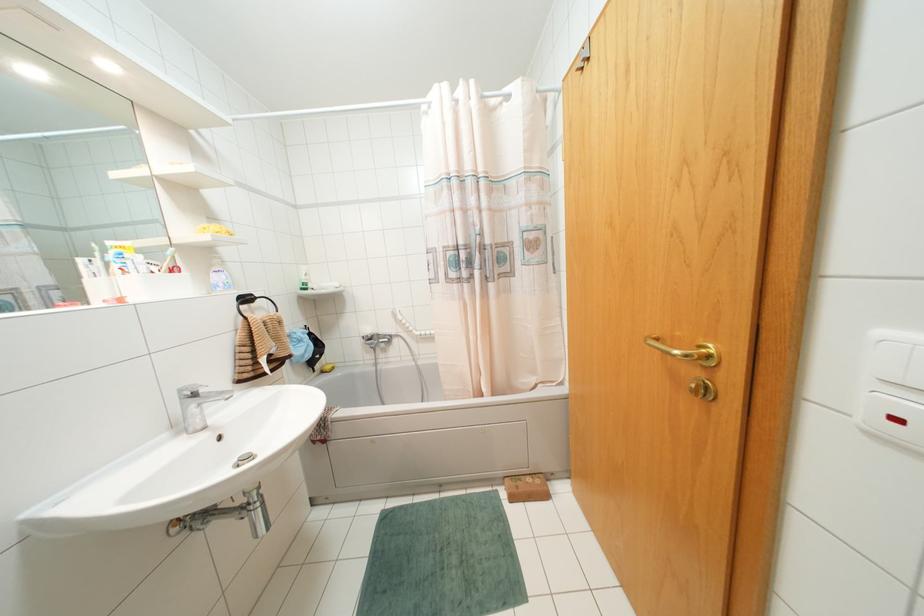
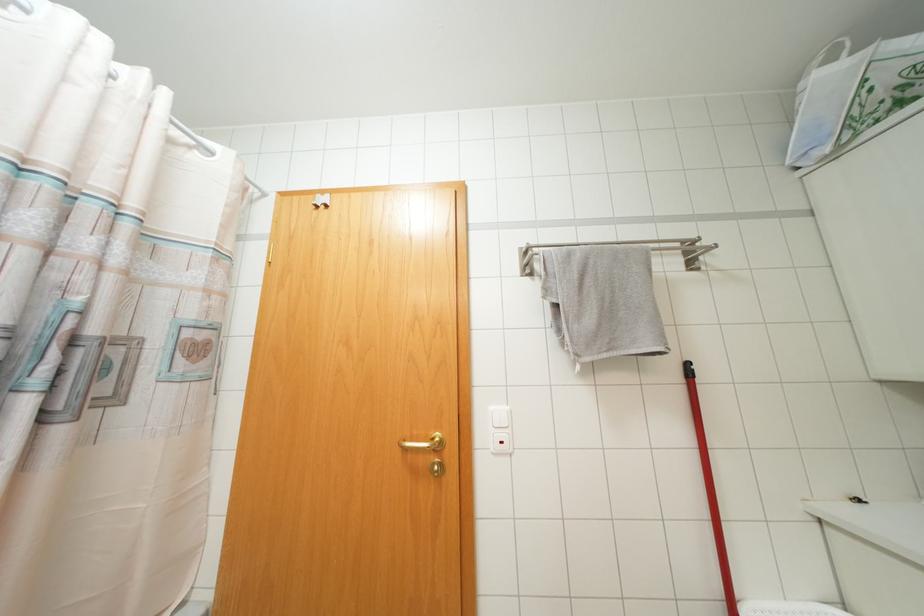
First-person continuous shooting, in which direction is the camera rotating?

The rotation direction of the camera is right-up.